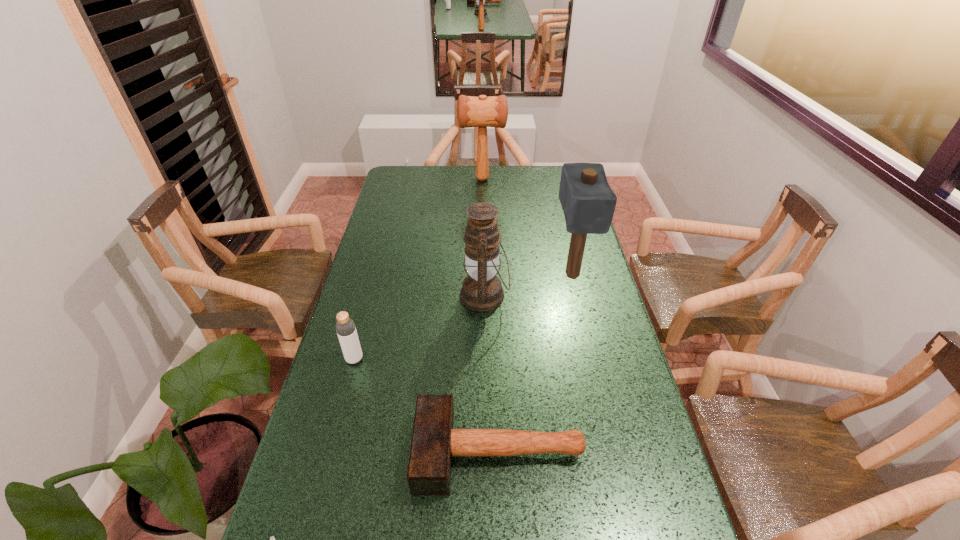
Find the location of a particular element. blank area located on the strike surface of the farthest mallet is located at coordinates (407, 179).

The image size is (960, 540). Identify the location of free spot located 0.240m on the strike surface of the farthest mallet. pos(407,179).

Locate an element on the screen. The image size is (960, 540). free location located on the front of the oil lamp is located at coordinates (486, 404).

The image size is (960, 540). Find the location of `free space located 0.090m on the right of the bottle`. free space located 0.090m on the right of the bottle is located at coordinates (395, 359).

This screenshot has height=540, width=960. I want to click on free space located on the hammer head face of the second nearest object, so click(391, 452).

This screenshot has width=960, height=540. Find the location of `vacant space situated on the hammer head face of the second nearest object`. vacant space situated on the hammer head face of the second nearest object is located at coordinates (357, 452).

Identify the location of vacant space located on the hammer head face of the second nearest object. (353, 452).

The image size is (960, 540). What are the coordinates of `object at the far edge` in the screenshot? It's located at (482, 112).

Find the location of a particular element. The width and height of the screenshot is (960, 540). object that is at the left edge is located at coordinates (345, 327).

The width and height of the screenshot is (960, 540). Identify the location of object that is positioned at the right edge. (588, 202).